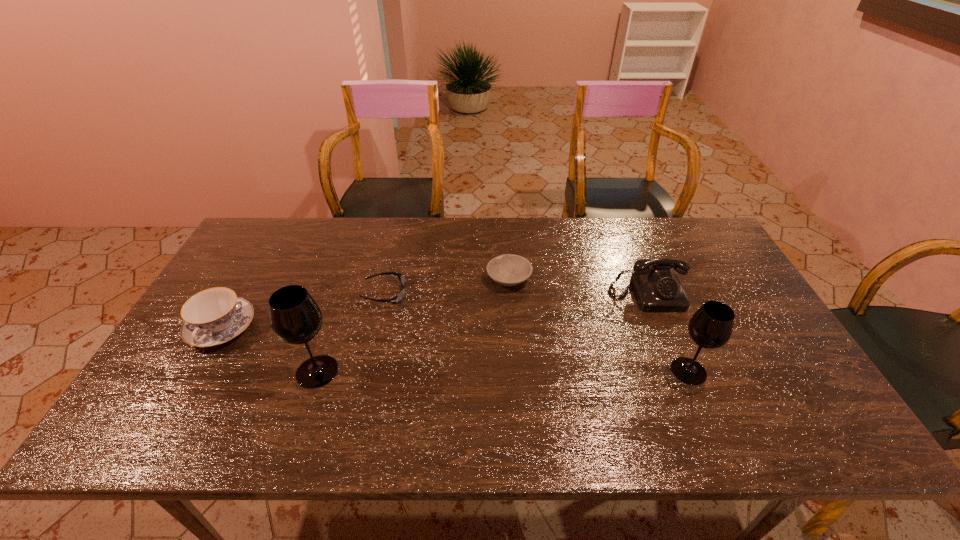
The width and height of the screenshot is (960, 540). I want to click on the tallest object, so click(295, 317).

What are the coordinates of `the taller wineglass` in the screenshot? It's located at (295, 317).

The height and width of the screenshot is (540, 960). In order to click on the shorter wineglass in this screenshot , I will do `click(711, 326)`.

Locate an element on the screen. Image resolution: width=960 pixels, height=540 pixels. the second tallest object is located at coordinates (711, 326).

Find the location of `bowl`. bowl is located at coordinates (508, 269).

I want to click on the third object from right to left, so click(x=508, y=269).

Locate an element on the screen. The width and height of the screenshot is (960, 540). the leftmost object is located at coordinates (214, 316).

The width and height of the screenshot is (960, 540). I want to click on chinaware, so (x=214, y=316).

The image size is (960, 540). I want to click on telephone, so click(x=657, y=289).

You are a GUI agent. You are given a task and a screenshot of the screen. Output one action in this format:
    pyautogui.click(x=<x>, y=<y>)
    Task: Click on the shortest object
    This screenshot has height=540, width=960.
    Given the screenshot: What is the action you would take?
    pyautogui.click(x=396, y=299)